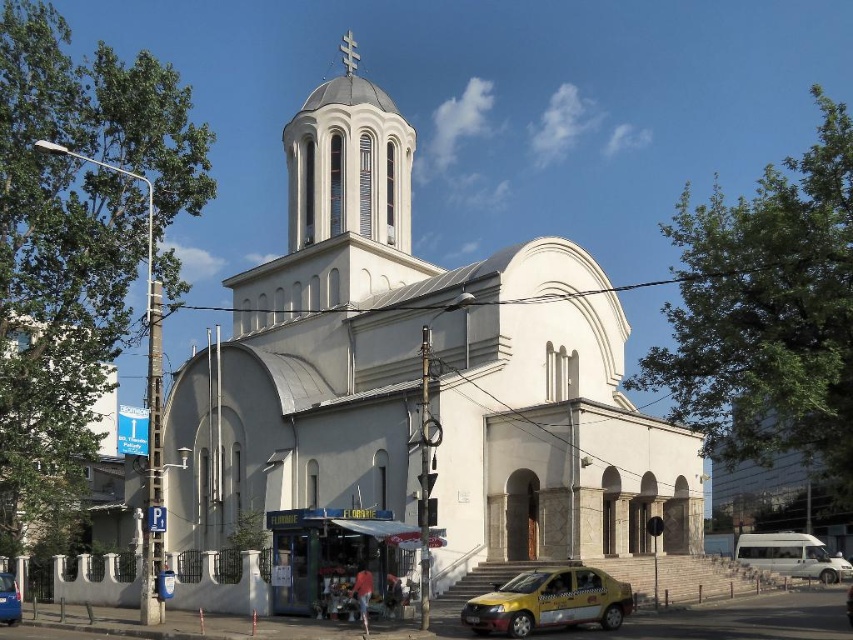
In the scene shown: You are a pedestrian standing at the entrance of the white church with a dome. You need to cross the street to reach the Floraria kiosk. There are two vehicles nearby, the yellow matte taxi at lower center and the blue metallic car at lower left. Which vehicle takes up more space horizontally between them?

The yellow matte taxi at lower center takes up more space horizontally because its width is larger than that of the blue metallic car at lower left.

You are standing at the center of the image and want to locate the white smooth church at center. According to the coordinates provided, in which direction should you look to find it?

The white smooth church at center is located at coordinates point (419,376), which is slightly to the right and center of the image. Since you are at the center, you should look towards the right direction to find it.

You are a delivery person who needs to park your vehicle in a space that is exactly 2 meters long. You have two options in the image, the yellow matte taxi at lower center and the blue metallic car at lower left. Which vehicle can fit into the parking space without overhanging?

The yellow matte taxi at lower center is shorter than the blue metallic car at lower left, so the yellow matte taxi at lower center can fit into the 2 meter parking space without overhanging.